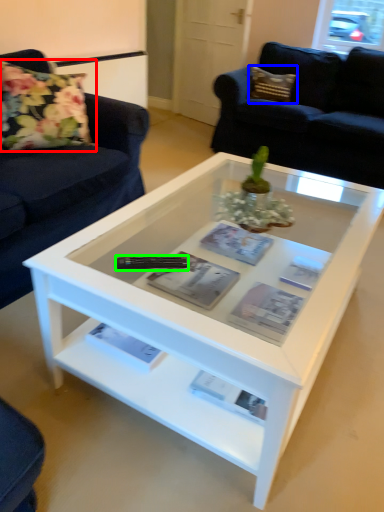
Question: Which object is positioned farthest from flower (highlighted by a red box)? Select from pillow (highlighted by a blue box) and remote (highlighted by a green box).

Choices:
 (A) pillow
 (B) remote

Answer: (A)